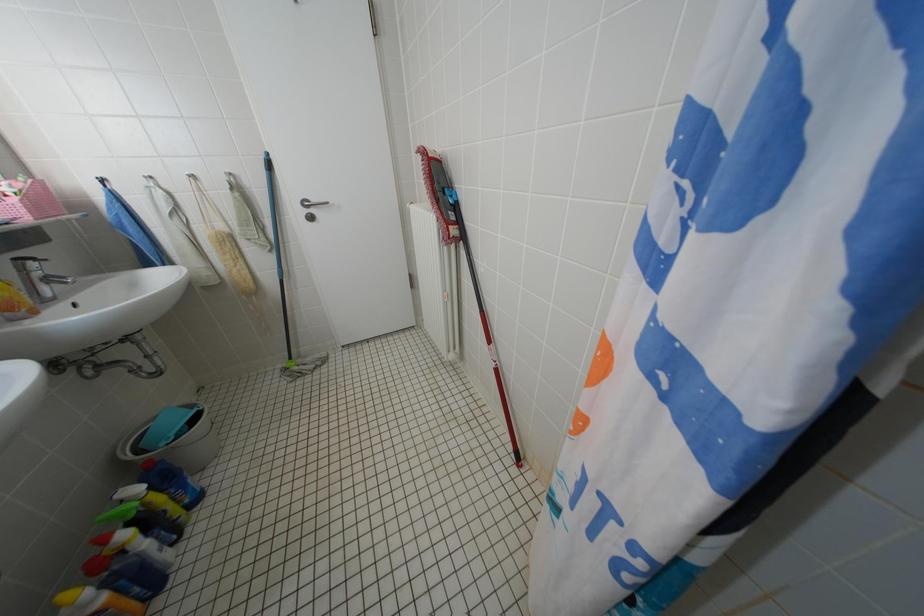
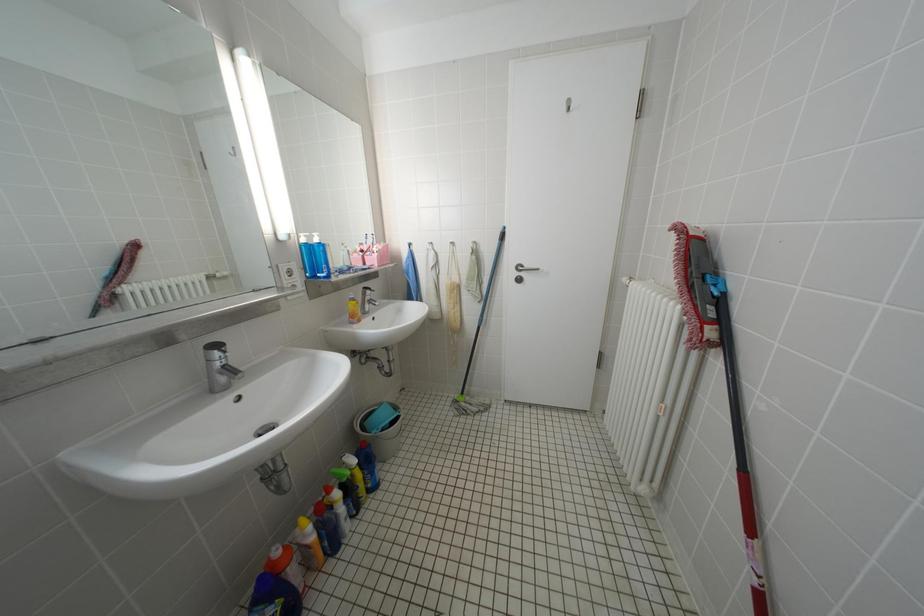
Question: Based on the continuous images, in which direction is the camera rotating? Reply with the corresponding letter.

Choices:
 (A) Left
 (B) Right
 (C) Up
 (D) Down

Answer: (A)